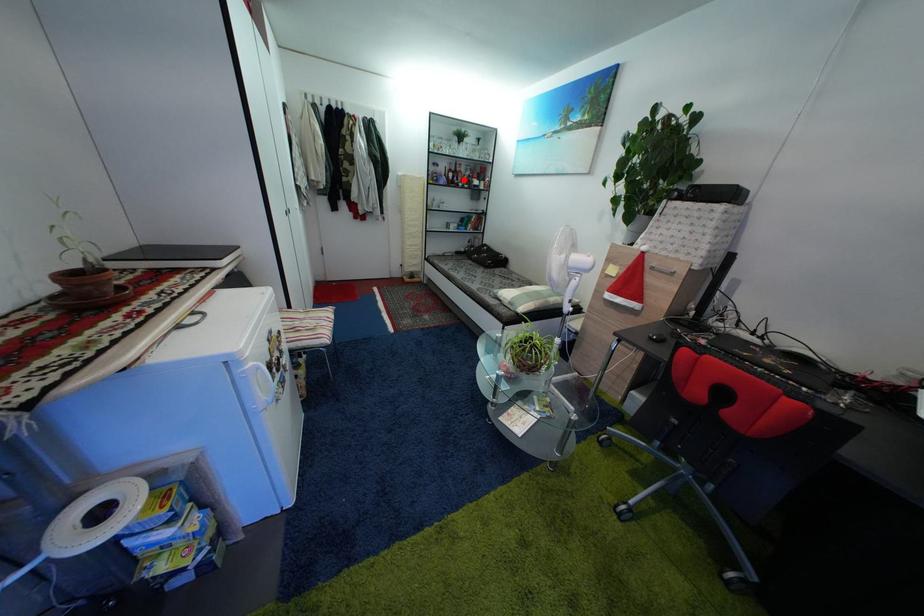
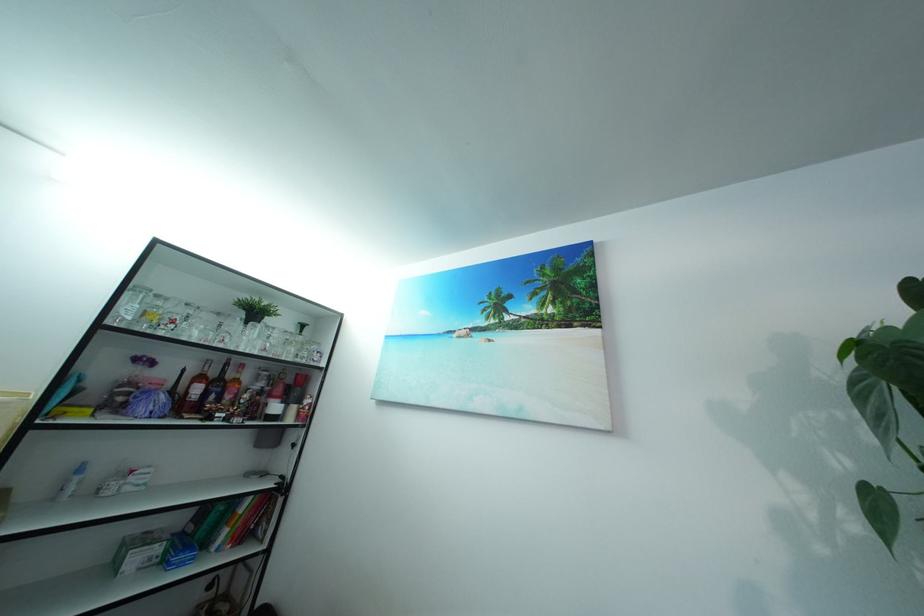
Question: I am providing you with two images of the same scene from different viewpoints. In image1, a red point is highlighted. Considering the same 3D point in image2, which of the following is correct?

Choices:
 (A) It is closer
 (B) It is farther

Answer: (B)